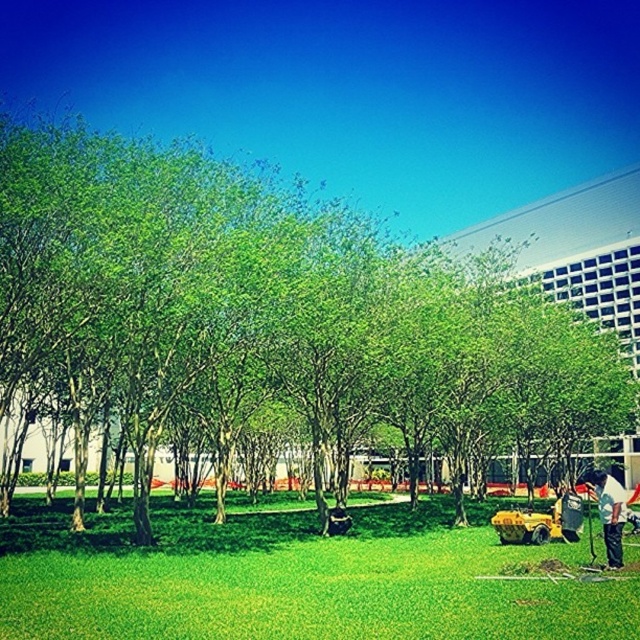
Which is behind, point (211, 442) or point (102, 598)?

Positioned behind is point (211, 442).

Does green leafy tree at center lie in front of green grass at lower center?

No.

This screenshot has height=640, width=640. What are the coordinates of `green leafy tree at center` in the screenshot? It's located at (273, 321).

The width and height of the screenshot is (640, 640). In order to click on green leafy tree at center in this screenshot , I will do `click(273, 321)`.

Can you confirm if green grass at lower center is wider than white fabric shirt at lower right?

Yes, green grass at lower center is wider than white fabric shirt at lower right.

Is green grass at lower center bigger than white fabric shirt at lower right?

No, green grass at lower center is not bigger than white fabric shirt at lower right.

What are the coordinates of `green grass at lower center` in the screenshot? It's located at (301, 580).

At what (x,y) coordinates should I click in order to perform the action: click on green leafy tree at center. Please return your answer as a coordinate pair (x, y). The image size is (640, 640). Looking at the image, I should click on (273, 321).

Where is `green leafy tree at center`? green leafy tree at center is located at coordinates (273, 321).